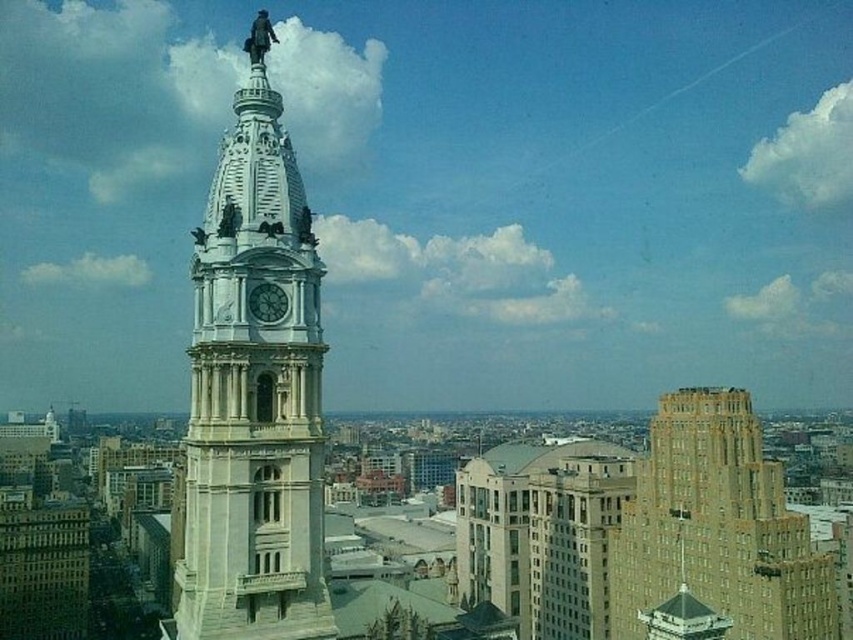
You are standing in the city square and want to take a photo of the white stone clock tower at center. To ensure the clock tower is centered in your photo, where should you position yourself relative to the clock tower?

To center the white stone clock tower at center in your photo, you should position yourself directly in front of it, aligned with its central axis, as it is located at point (x=254, y=392) in the image.

You are standing at the point marked as point [717,528] in the cityscape image. What type of building are you currently at?

The point [717,528] corresponds to a brown brick building at center right.